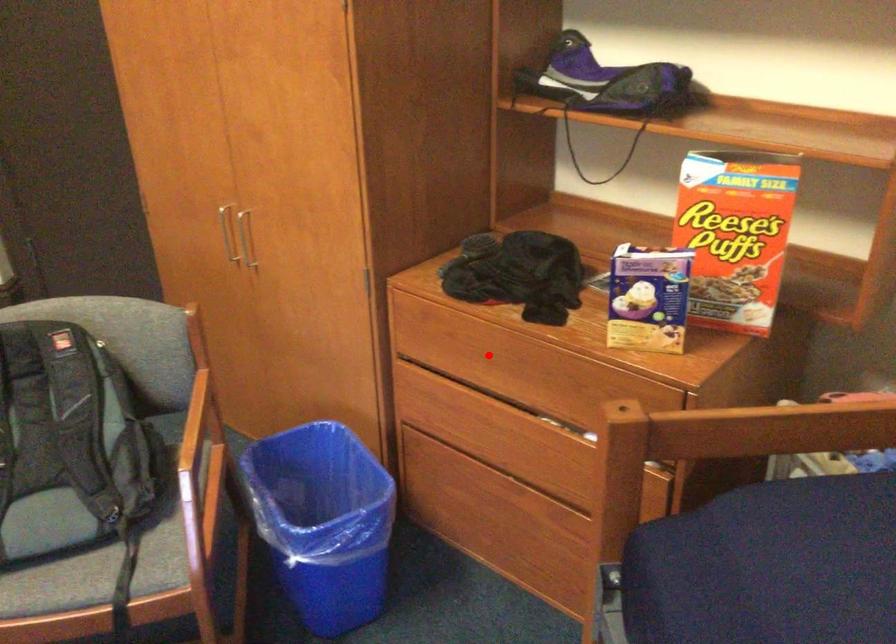
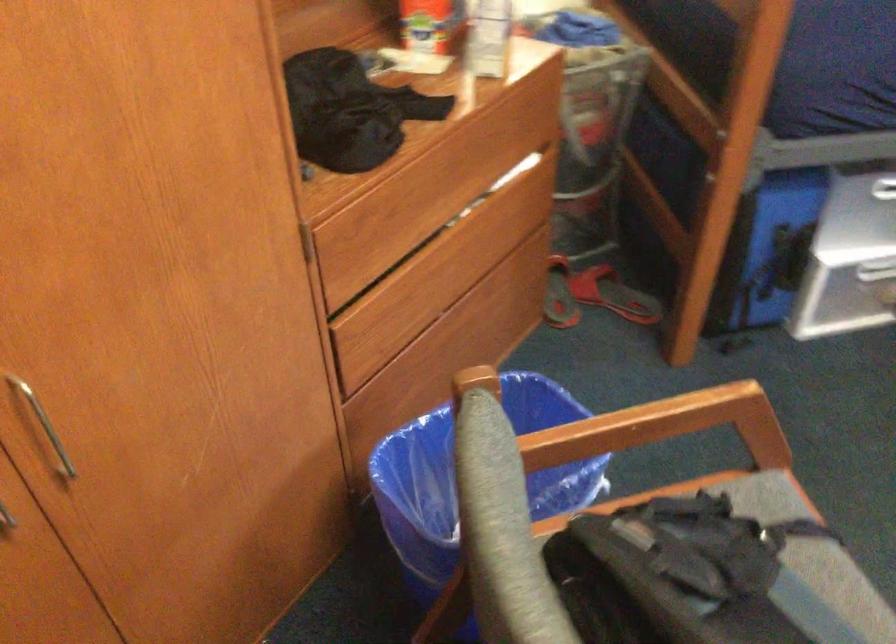
Question: I am providing you with two images of the same scene from different viewpoints. In image1, a red point is highlighted. Considering the same 3D point in image2, which of the following is correct?

Choices:
 (A) It is closer
 (B) It is farther

Answer: (A)